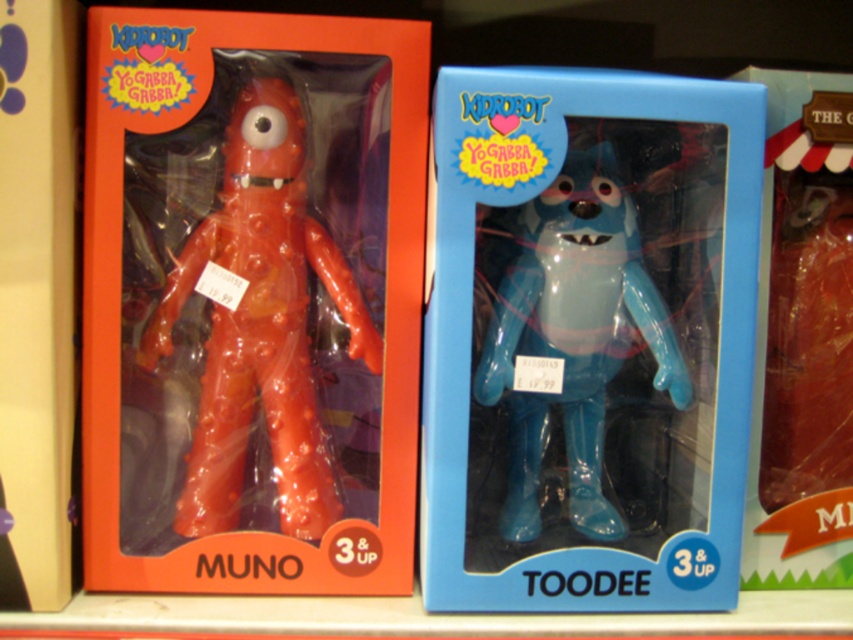
Question: Which point is farther from the camera taking this photo?

Choices:
 (A) (274, 161)
 (B) (708, 436)

Answer: (B)

Question: Is the position of rubbery red figure at center more distant than that of glossy plastic bear at center?

Choices:
 (A) no
 (B) yes

Answer: (B)

Question: Observing the image, what is the correct spatial positioning of blue glossy vinyl figure at center in reference to rubbery red figure at center?

Choices:
 (A) right
 (B) left

Answer: (A)

Question: Does rubbery red figure at center appear on the left side of glossy plastic bear at center?

Choices:
 (A) yes
 (B) no

Answer: (A)

Question: Which point is farther to the camera?

Choices:
 (A) (376, 364)
 (B) (561, 241)
 (C) (630, 202)

Answer: (C)

Question: Among these points, which one is nearest to the camera?

Choices:
 (A) (265, 186)
 (B) (587, 516)
 (C) (434, 424)

Answer: (C)